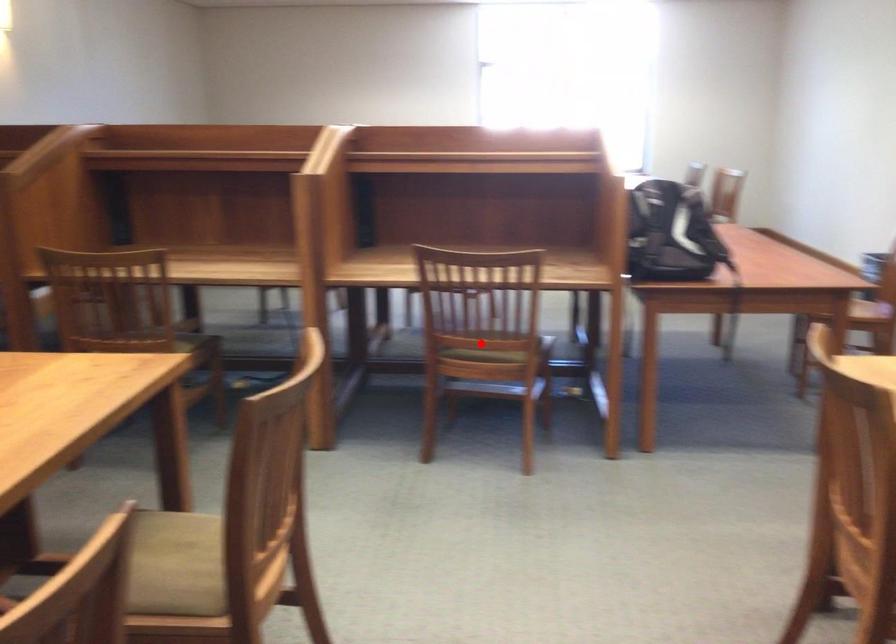
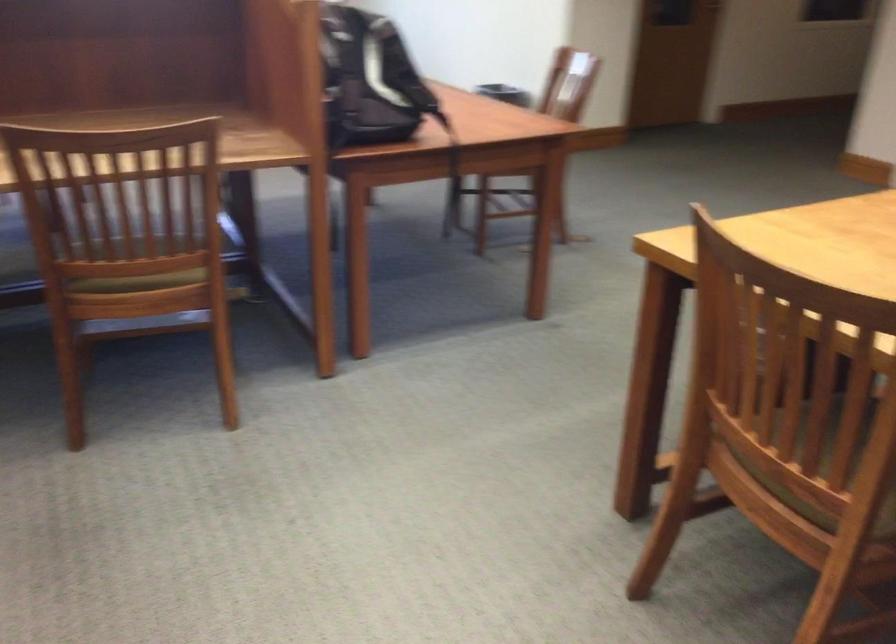
In the second image, find the point that corresponds to the highlighted location in the first image.

(139, 266)